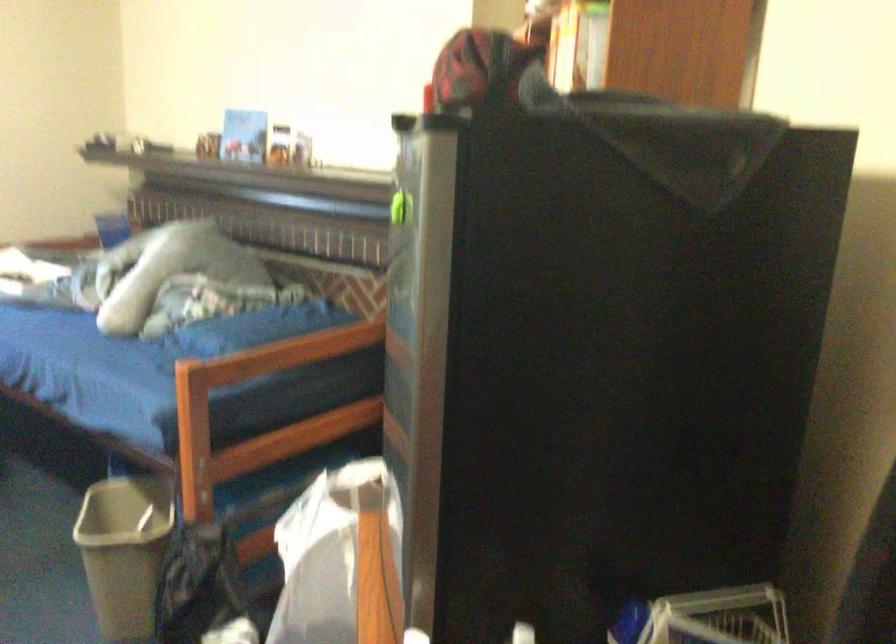
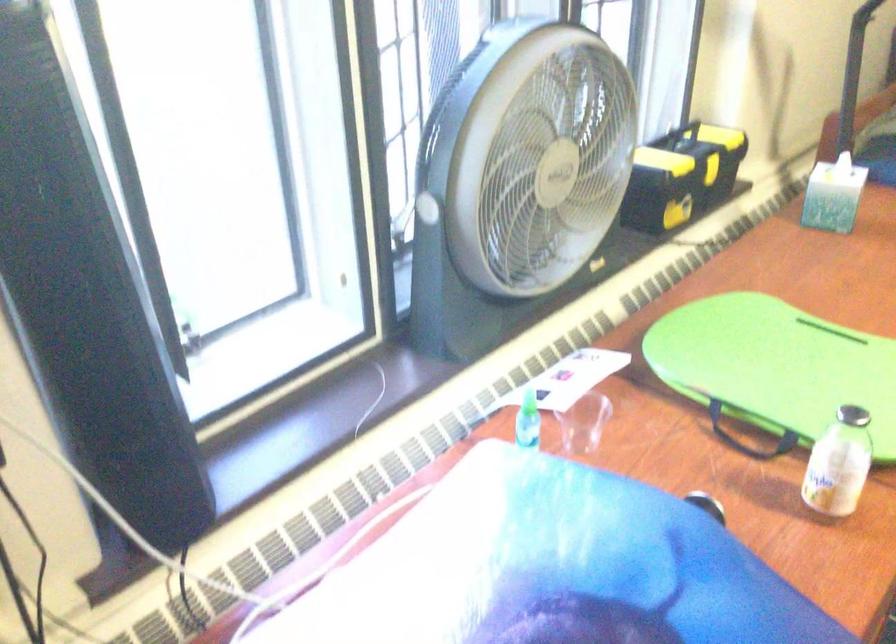
Question: In a continuous first-person perspective shot, in which direction is the camera moving?

Choices:
 (A) Left
 (B) Right
 (C) Forward
 (D) Backward

Answer: (A)